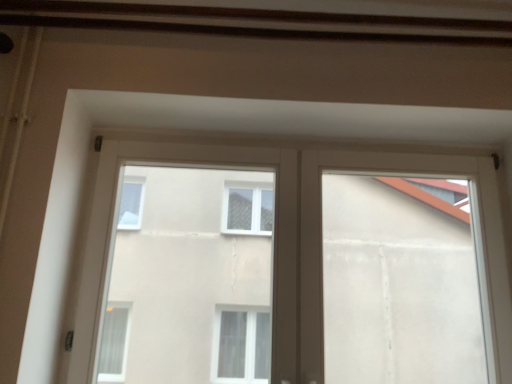
Question: Is transparent glass window at center wider or thinner than white plastic window at upper center?

Choices:
 (A) thin
 (B) wide

Answer: (A)

Question: Do you think transparent glass window at center is within white plastic window at upper center, or outside of it?

Choices:
 (A) inside
 (B) outside

Answer: (A)

Question: Estimate the real-world distances between objects in this image. Which object is farther from the transparent glass window at center?

Choices:
 (A) white plastic window at upper center
 (B) white plastic window frame at upper center

Answer: (A)

Question: Estimate the real-world distances between objects in this image. Which object is farther from the white plastic window at upper center?

Choices:
 (A) white plastic window frame at upper center
 (B) transparent glass window at center

Answer: (B)